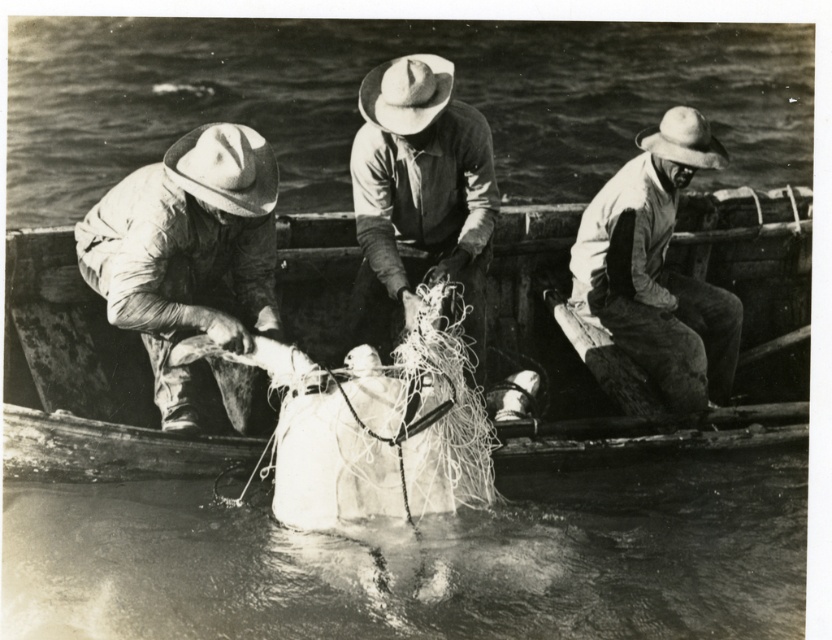
Which is below, white cotton shirt at right or rough fabric hat at center?

white cotton shirt at right is lower down.

Is white cotton shirt at right closer to camera compared to rough fabric hat at center?

No, it is not.

Identify the location of white cotton shirt at right. The image size is (832, 640). (652, 280).

Between wooden boat at center and rough fabric hat at center, which one appears on the right side from the viewer's perspective?

wooden boat at center is more to the right.

Is point (541, 307) positioned after point (443, 138)?

Yes, it is behind point (443, 138).

The height and width of the screenshot is (640, 832). What do you see at coordinates (689, 276) in the screenshot?
I see `wooden boat at center` at bounding box center [689, 276].

Where is `wooden boat at center`? This screenshot has height=640, width=832. wooden boat at center is located at coordinates (689, 276).

Which is below, wooden boat at center or matte white shirt at left?

wooden boat at center is lower down.

Find the location of a particular element. The height and width of the screenshot is (640, 832). wooden boat at center is located at coordinates (689, 276).